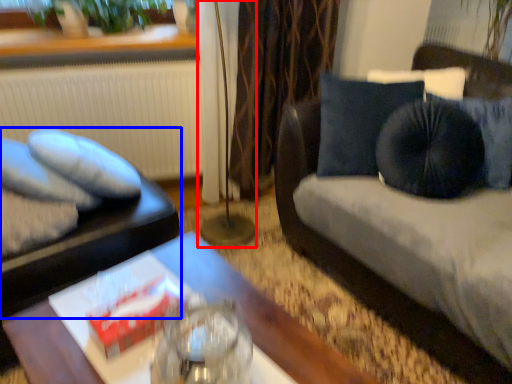
Question: Among these objects, which one is farthest to the camera, lamp (highlighted by a red box) or furniture (highlighted by a blue box)?

Choices:
 (A) lamp
 (B) furniture

Answer: (A)